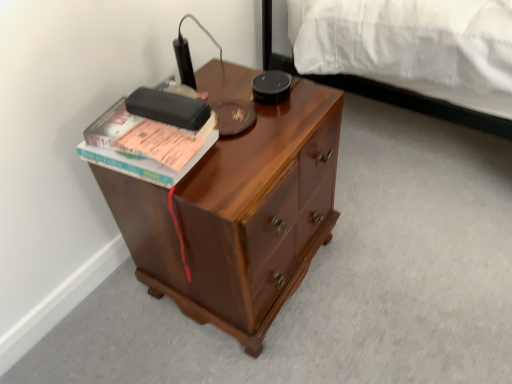
Locate an element on the screen. vacant area that is situated to the right of hardcover book at upper left is located at coordinates (254, 148).